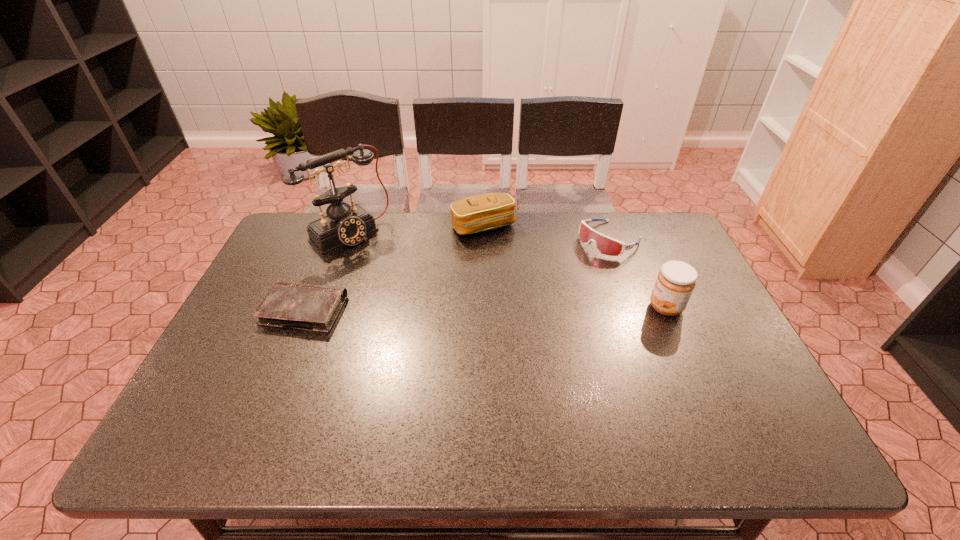
Locate an element on the screen. Image resolution: width=960 pixels, height=540 pixels. empty space between the jam and the diary is located at coordinates (485, 309).

Image resolution: width=960 pixels, height=540 pixels. Find the location of `free space that is in between the second tallest object and the diary`. free space that is in between the second tallest object and the diary is located at coordinates (485, 309).

I want to click on empty space between the clutch bag and the tallest object, so click(x=416, y=230).

The image size is (960, 540). Find the location of `free space between the clutch bag and the diary`. free space between the clutch bag and the diary is located at coordinates (394, 268).

You are a GUI agent. You are given a task and a screenshot of the screen. Output one action in this format:
    pyautogui.click(x=<x>, y=<y>)
    Task: Click on the vacant area that lies between the goggles and the jam
    This screenshot has width=960, height=540.
    Given the screenshot: What is the action you would take?
    pyautogui.click(x=638, y=273)

Choose which object is the fourth nearest neighbor to the second tallest object. Please provide its 2D coordinates. Your answer should be formatted as a tuple, i.e. [(x, y)], where the tuple contains the x and y coordinates of a point satisfying the conditions above.

[(309, 307)]

At what (x,y) coordinates should I click in order to perform the action: click on object that is the nearest to the jam. Please return your answer as a coordinate pair (x, y). Looking at the image, I should click on [x=605, y=245].

The image size is (960, 540). Find the location of `vacant space that satisfies the following two spatial constraints: 1. on the front side of the telephone; 2. on the front label of the jam`. vacant space that satisfies the following two spatial constraints: 1. on the front side of the telephone; 2. on the front label of the jam is located at coordinates 321,307.

Locate an element on the screen. Image resolution: width=960 pixels, height=540 pixels. free space that satisfies the following two spatial constraints: 1. on the front side of the fourth tallest object; 2. on the front label of the jam is located at coordinates (635, 307).

At what (x,y) coordinates should I click in order to perform the action: click on free location that satisfies the following two spatial constraints: 1. on the front side of the third tallest object; 2. on the right side of the fourth tallest object. Please return your answer as a coordinate pair (x, y). The height and width of the screenshot is (540, 960). Looking at the image, I should click on (483, 239).